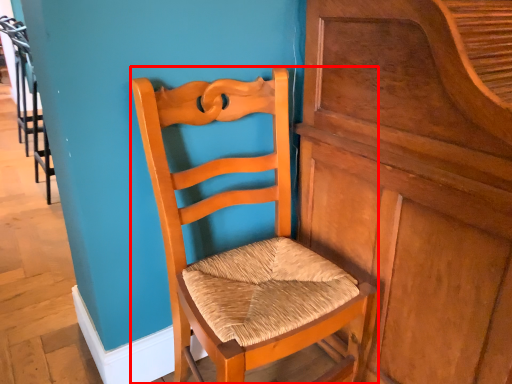
Question: Observing the image, what is the correct spatial positioning of chair (annotated by the red box) in reference to dresser?

Choices:
 (A) left
 (B) right

Answer: (A)